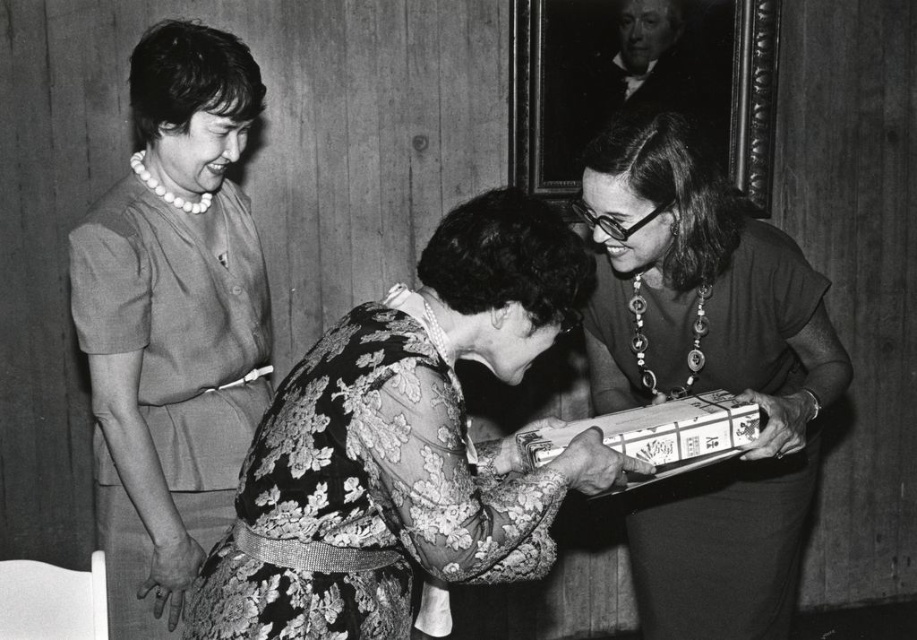
The height and width of the screenshot is (640, 917). Find the location of `pearl necklace at upper left`. pearl necklace at upper left is located at coordinates (172, 321).

From the picture: How much distance is there between pearl necklace at upper left and patterned paper package at center?

They are 27.67 inches apart.

The height and width of the screenshot is (640, 917). Identify the location of pearl necklace at upper left. [x=172, y=321].

Can you confirm if floral-patterned dress at center is positioned to the right of matte black box at center?

In fact, floral-patterned dress at center is to the left of matte black box at center.

Between floral-patterned dress at center and matte black box at center, which one has less height?

floral-patterned dress at center

Does point (455, 262) come behind point (819, 412)?

No, (455, 262) is in front of (819, 412).

The image size is (917, 640). I want to click on floral-patterned dress at center, so click(404, 444).

Does matte black box at center have a smaller size compared to pearl necklace at upper left?

Incorrect, matte black box at center is not smaller in size than pearl necklace at upper left.

Between matte black box at center and pearl necklace at upper left, which one is positioned lower?

matte black box at center is lower down.

Does point (631, 241) come farther from viewer compared to point (162, 216)?

That is False.

Where is `matte black box at center`? matte black box at center is located at coordinates (706, 376).